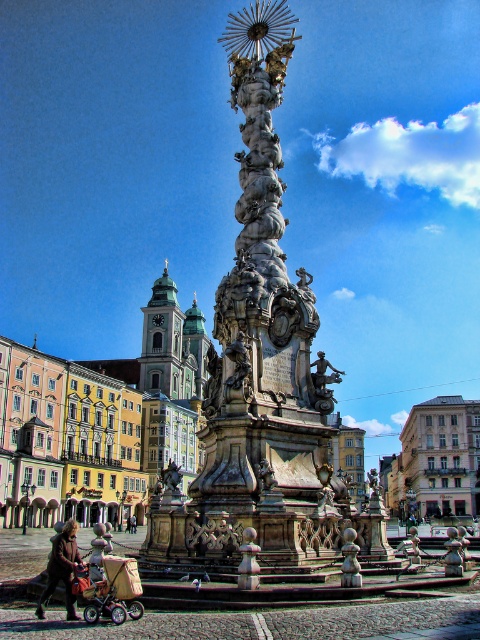
Which is in front, point (194, 365) or point (130, 522)?

Point (130, 522)

Does point (153, 360) lie behind point (133, 525)?

Yes, point (153, 360) is behind point (133, 525).

At what (x,y) coordinates should I click in order to perform the action: click on green stone tower at center. Please return your answer as a coordinate pair (x, y). Looking at the image, I should click on click(x=171, y=344).

Can you confirm if brown leather coat at lower left is positioned below bronze statue at center?

Yes.

Who is more forward, (72, 545) or (324, 380)?

Point (72, 545) is in front.

Describe the element at coordinates (61, 568) in the screenshot. I see `brown leather coat at lower left` at that location.

Where is `brown leather coat at lower left`? brown leather coat at lower left is located at coordinates (61, 568).

Does green stone tower at center appear over brown leather coat at lower left?

Yes, green stone tower at center is above brown leather coat at lower left.

Does point (154, 365) come farther from viewer compared to point (67, 612)?

That is True.

At what (x,y) coordinates should I click in order to perform the action: click on green stone tower at center. Please return your answer as a coordinate pair (x, y). Looking at the image, I should click on (171, 344).